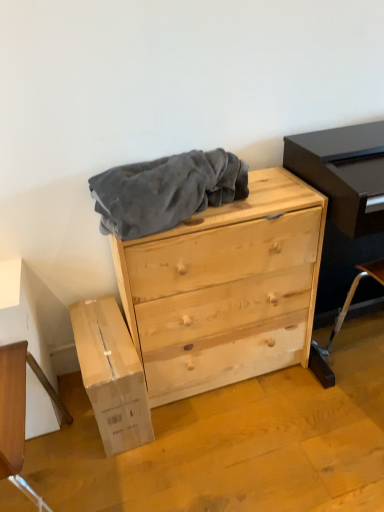
The image size is (384, 512). Find the location of `matte black entertainment center at right`. matte black entertainment center at right is located at coordinates (343, 199).

This screenshot has width=384, height=512. What are the coordinates of `velvety gray blanket at center` in the screenshot? It's located at (166, 191).

Image resolution: width=384 pixels, height=512 pixels. Describe the element at coordinates (225, 289) in the screenshot. I see `natural wood chest of drawers at center` at that location.

You are a GUI agent. You are given a task and a screenshot of the screen. Output one action in this format:
    pyautogui.click(x=<x>, y=<y>)
    Task: Click on the matte black entertainment center at right
    
    Given the screenshot: What is the action you would take?
    pyautogui.click(x=343, y=199)

From a real-world perspective, is velvety gray blanket at center beneath matte black entertainment center at right?

Actually, velvety gray blanket at center is physically above matte black entertainment center at right in the real world.

Can you confirm if velvety gray blanket at center is positioned to the left of matte black entertainment center at right?

Yes, velvety gray blanket at center is to the left of matte black entertainment center at right.

Is the position of velvety gray blanket at center less distant than that of matte black entertainment center at right?

No.

From the image's perspective, relative to matte black entertainment center at right, is white cardboard box at lower left above or below?

Clearly, from the image's perspective, white cardboard box at lower left is below matte black entertainment center at right.

Is white cardboard box at lower left positioned with its back to matte black entertainment center at right?

No, white cardboard box at lower left's orientation is not away from matte black entertainment center at right.

There is a white cardboard box at lower left. Identify the location of entertainment center above it (from a real-world perspective). (343, 199).

From the image's perspective, which one is positioned higher, matte black entertainment center at right or white cardboard box at lower left?

From the image's view, matte black entertainment center at right is above.

From a real-world perspective, relative to white cardboard box at lower left, is matte black entertainment center at right vertically above or below?

matte black entertainment center at right is situated higher than white cardboard box at lower left in the real world.

Can you confirm if matte black entertainment center at right is smaller than white cardboard box at lower left?

Actually, matte black entertainment center at right might be larger than white cardboard box at lower left.

Is matte black entertainment center at right turned away from white cardboard box at lower left?

No, matte black entertainment center at right is not facing away from white cardboard box at lower left.

In the scene shown: How distant is white cardboard box at lower left from velvety gray blanket at center?

white cardboard box at lower left is 18.46 inches from velvety gray blanket at center.

Consider the image. Does white cardboard box at lower left have a lesser width compared to velvety gray blanket at center?

In fact, white cardboard box at lower left might be wider than velvety gray blanket at center.

Is white cardboard box at lower left facing towards velvety gray blanket at center?

No.

Is the depth of white cardboard box at lower left less than that of velvety gray blanket at center?

That is False.

Is matte black entertainment center at right thinner than velvety gray blanket at center?

No.

Can you tell me how much matte black entertainment center at right and velvety gray blanket at center differ in facing direction?

180 degrees.

Which point is more forward, (356, 152) or (139, 191)?

The point (139, 191) is more forward.

Does matte black entertainment center at right turn towards velvety gray blanket at center?

No, matte black entertainment center at right does not turn towards velvety gray blanket at center.

In terms of size, does matte black entertainment center at right appear bigger or smaller than natural wood chest of drawers at center?

Considering their sizes, matte black entertainment center at right takes up less space than natural wood chest of drawers at center.

Would you say matte black entertainment center at right is outside natural wood chest of drawers at center?

matte black entertainment center at right is positioned outside natural wood chest of drawers at center.

Considering their positions, is matte black entertainment center at right located in front of or behind natural wood chest of drawers at center?

Clearly, matte black entertainment center at right is in front of natural wood chest of drawers at center.

Is matte black entertainment center at right thinner than natural wood chest of drawers at center?

Correct, the width of matte black entertainment center at right is less than that of natural wood chest of drawers at center.

Looking at this image, from the image's perspective, is natural wood chest of drawers at center on white cardboard box at lower left?

Indeed, from the image's perspective, natural wood chest of drawers at center is shown above white cardboard box at lower left.

Is natural wood chest of drawers at center located outside white cardboard box at lower left?

Yes, natural wood chest of drawers at center is located beyond the bounds of white cardboard box at lower left.

Does point (156, 264) lie in front of point (115, 429)?

Yes, it is in front of point (115, 429).

Find the location of a particular element. The image size is (384, 512). clothing that appears above the matte black entertainment center at right (from a real-world perspective) is located at coordinates (166, 191).

You are a GUI agent. You are given a task and a screenshot of the screen. Output one action in this format:
    pyautogui.click(x=<x>, y=<y>)
    Task: Click on the cardboard box behind the matte black entertainment center at right
    The width and height of the screenshot is (384, 512).
    Given the screenshot: What is the action you would take?
    pyautogui.click(x=111, y=375)

Based on their spatial positions, is natural wood chest of drawers at center or white cardboard box at lower left closer to velvety gray blanket at center?

Among the two, natural wood chest of drawers at center is located nearer to velvety gray blanket at center.

Based on their spatial positions, is velvety gray blanket at center or white cardboard box at lower left further from natural wood chest of drawers at center?

white cardboard box at lower left lies further to natural wood chest of drawers at center than the other object.

Looking at the image, which one is located further to velvety gray blanket at center, natural wood chest of drawers at center or matte black entertainment center at right?

matte black entertainment center at right is further to velvety gray blanket at center.

Looking at the image, which one is located further to matte black entertainment center at right, white cardboard box at lower left or velvety gray blanket at center?

white cardboard box at lower left is positioned further to the anchor matte black entertainment center at right.

Estimate the real-world distances between objects in this image. Which object is further from matte black entertainment center at right, velvety gray blanket at center or natural wood chest of drawers at center?

Among the two, velvety gray blanket at center is located further to matte black entertainment center at right.

Based on their spatial positions, is matte black entertainment center at right or white cardboard box at lower left further from velvety gray blanket at center?

white cardboard box at lower left is further to velvety gray blanket at center.

In the scene shown: Which object lies further to the anchor point white cardboard box at lower left, natural wood chest of drawers at center or velvety gray blanket at center?

The object further to white cardboard box at lower left is velvety gray blanket at center.

Looking at the image, which one is located further to velvety gray blanket at center, white cardboard box at lower left or natural wood chest of drawers at center?

white cardboard box at lower left.

The height and width of the screenshot is (512, 384). I want to click on chest of drawers between velvety gray blanket at center and matte black entertainment center at right from left to right, so [225, 289].

The height and width of the screenshot is (512, 384). I want to click on chest of drawers between velvety gray blanket at center and white cardboard box at lower left in the up-down direction, so click(225, 289).

The width and height of the screenshot is (384, 512). Identify the location of the chest of drawers located between white cardboard box at lower left and matte black entertainment center at right in the left-right direction. (225, 289).

Identify the location of clothing between white cardboard box at lower left and matte black entertainment center at right in the horizontal direction. The width and height of the screenshot is (384, 512). (166, 191).